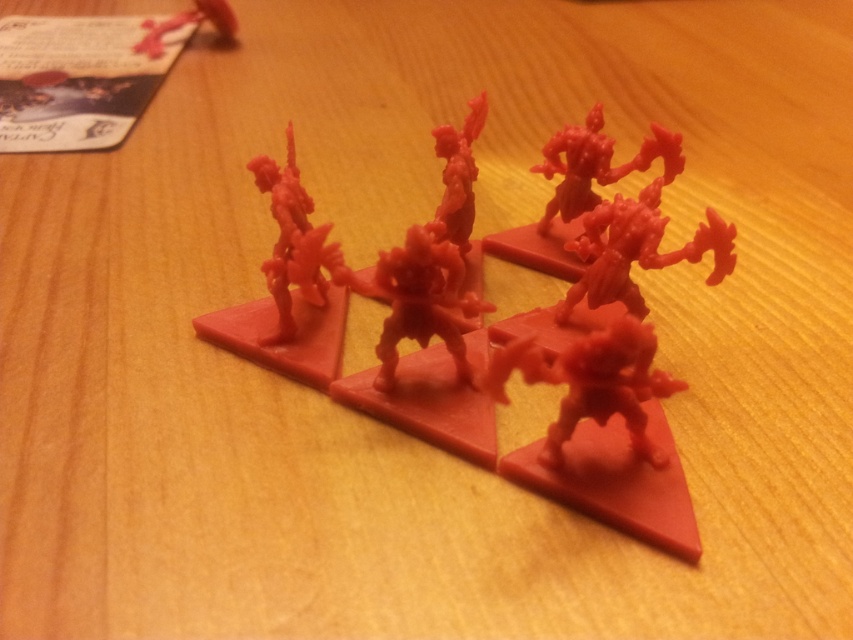
Which is more to the right, matte plastic toy at center or matte plastic miniature at center?

matte plastic toy at center is more to the right.

Is matte plastic toy at center bigger than matte plastic miniature at center?

Indeed, matte plastic toy at center has a larger size compared to matte plastic miniature at center.

Is point (695, 550) farther from viewer compared to point (299, 177)?

No.

Find the location of `matte plastic toy at center`. matte plastic toy at center is located at coordinates (538, 369).

Is matte plastic toy at center below matte plastic toy at upper left?

Indeed, matte plastic toy at center is positioned under matte plastic toy at upper left.

Does matte plastic toy at center lie in front of matte plastic toy at upper left?

Yes, matte plastic toy at center is in front of matte plastic toy at upper left.

You are a GUI agent. You are given a task and a screenshot of the screen. Output one action in this format:
    pyautogui.click(x=<x>, y=<y>)
    Task: Click on the matte plastic toy at center
    Image resolution: width=853 pixels, height=640 pixels.
    Given the screenshot: What is the action you would take?
    pyautogui.click(x=538, y=369)

Can you confirm if matte plastic miniature at center is bigger than matte plastic toy at upper left?

Yes.

Can you confirm if matte plastic miniature at center is wider than matte plastic toy at upper left?

Incorrect, matte plastic miniature at center's width does not surpass matte plastic toy at upper left's.

This screenshot has height=640, width=853. What do you see at coordinates (293, 241) in the screenshot? I see `matte plastic miniature at center` at bounding box center [293, 241].

Find the location of `matte plastic miniature at center`. matte plastic miniature at center is located at coordinates (293, 241).